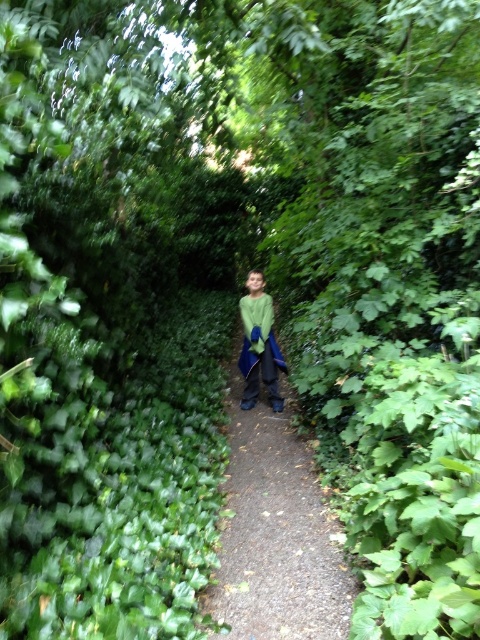
You are standing on the smooth dirt path at center and see the green matte jacket at center. Which direction should you move to reach the jacket?

The green matte jacket at center is to the left of the smooth dirt path at center, so you should move to the left to reach it.

You are a hiker carrying a backpack and see the smooth dirt path at center and the green matte jacket at center. You want to place your backpack on the ground between them. Is there enough space to do so?

The distance between the smooth dirt path at center and the green matte jacket at center is 37.90 inches, so yes, there is enough space to place your backpack between them.

You are a hiker carrying a green matte jacket at center and walking along the smooth dirt path at center. Can you walk sideways on the path without touching the jacket to the sides?

The smooth dirt path at center is wider than the green matte jacket at center, so yes, you can walk sideways on the path without touching the jacket to the sides.